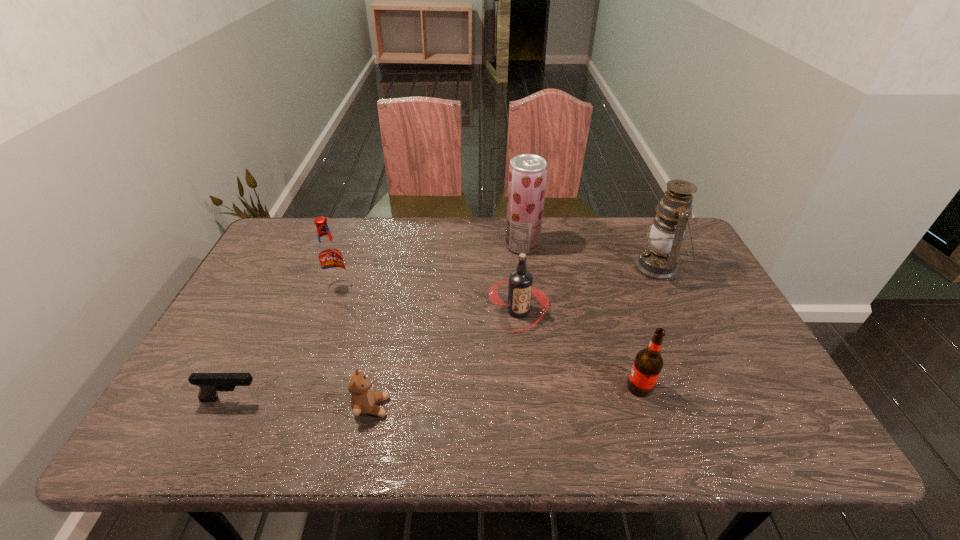
At what (x,y) coordinates should I click in order to perform the action: click on pistol. Please return your answer as a coordinate pair (x, y). Looking at the image, I should click on (209, 383).

The image size is (960, 540). In order to click on vacant area situated 0.380m on the front of the fruit juice in this screenshot , I will do (x=535, y=349).

The width and height of the screenshot is (960, 540). Find the location of `blank space located 0.140m on the front of the oil lamp`. blank space located 0.140m on the front of the oil lamp is located at coordinates (684, 324).

This screenshot has height=540, width=960. I want to click on free location located on the back of the sixth object from right to left, so coord(359,230).

You are a GUI agent. You are given a task and a screenshot of the screen. Output one action in this format:
    pyautogui.click(x=<x>, y=<y>)
    Task: Click on the free point located on the label of the second root beer from right to left
    This screenshot has width=960, height=540.
    Given the screenshot: What is the action you would take?
    pyautogui.click(x=530, y=430)

Locate an element on the screen. blank space located on the left of the rightmost root beer is located at coordinates (541, 387).

Locate an element on the screen. vacant space located on the front-facing side of the third object from left to right is located at coordinates (500, 407).

This screenshot has width=960, height=540. I want to click on free space located 0.150m on the front-facing side of the leftmost object, so click(x=328, y=400).

Where is `fruit juice that is positioned at the far edge`? fruit juice that is positioned at the far edge is located at coordinates (527, 178).

You are a GUI agent. You are given a task and a screenshot of the screen. Output one action in this format:
    pyautogui.click(x=<x>, y=<y>)
    Task: Click on the oil lamp located at the far edge
    The height and width of the screenshot is (540, 960).
    Given the screenshot: What is the action you would take?
    pyautogui.click(x=659, y=261)